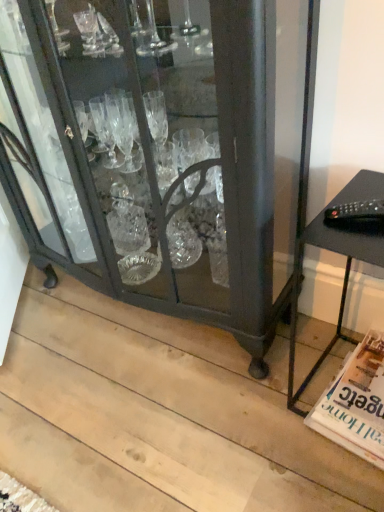
Identify the location of black matte table at right. (343, 281).

Where is `matte black cabinet at center`? matte black cabinet at center is located at coordinates (161, 152).

The width and height of the screenshot is (384, 512). What do you see at coordinates (355, 403) in the screenshot?
I see `white glossy magazine at lower right` at bounding box center [355, 403].

I want to click on black matte table at right, so click(x=343, y=281).

Which is more to the left, black matte table at right or matte black cabinet at center?

From the viewer's perspective, matte black cabinet at center appears more on the left side.

How much distance is there between black matte table at right and matte black cabinet at center?

A distance of 16.92 inches exists between black matte table at right and matte black cabinet at center.

How many degrees apart are the facing directions of black matte table at right and matte black cabinet at center?

The angular difference between black matte table at right and matte black cabinet at center is 5.83 degrees.

Does black matte table at right come in front of matte black cabinet at center?

No, it is behind matte black cabinet at center.

Is black matte table at right oriented towards white glossy magazine at lower right?

No.

In the image, is black matte table at right positioned in front of or behind white glossy magazine at lower right?

black matte table at right is positioned closer to the viewer than white glossy magazine at lower right.

Can you confirm if black matte table at right is wider than white glossy magazine at lower right?

In fact, black matte table at right might be narrower than white glossy magazine at lower right.

Who is taller, black matte table at right or white glossy magazine at lower right?

black matte table at right is taller.

Can you confirm if matte black cabinet at center is positioned to the right of black matte table at right?

In fact, matte black cabinet at center is to the left of black matte table at right.

Which of these two, matte black cabinet at center or black matte table at right, stands taller?

With more height is matte black cabinet at center.

Is matte black cabinet at center spatially inside black matte table at right, or outside of it?

matte black cabinet at center is outside black matte table at right.

Are matte black cabinet at center and black matte table at right far apart?

No, matte black cabinet at center is in close proximity to black matte table at right.

Is white glossy magazine at lower right thinner than matte black cabinet at center?

Incorrect, the width of white glossy magazine at lower right is not less than that of matte black cabinet at center.

How different are the orientations of white glossy magazine at lower right and matte black cabinet at center in degrees?

They differ by 6.92 degrees in their facing directions.

In the scene shown: Is white glossy magazine at lower right positioned with its back to matte black cabinet at center?

No, white glossy magazine at lower right's orientation is not away from matte black cabinet at center.

Which is in front, point (356, 444) or point (328, 229)?

The point (328, 229) is in front.

Who is bigger, white glossy magazine at lower right or black matte table at right?

black matte table at right is bigger.

Is white glossy magazine at lower right with black matte table at right?

They are not placed beside each other.

Relative to black matte table at right, is white glossy magazine at lower right in front or behind?

Visually, white glossy magazine at lower right is located behind black matte table at right.

Between matte black cabinet at center and white glossy magazine at lower right, which one has less height?

Standing shorter between the two is white glossy magazine at lower right.

How much distance is there between matte black cabinet at center and white glossy magazine at lower right?

matte black cabinet at center and white glossy magazine at lower right are 26.58 inches apart.

Which of these two, matte black cabinet at center or white glossy magazine at lower right, is smaller?

Smaller between the two is white glossy magazine at lower right.

Locate an element on the screen. The width and height of the screenshot is (384, 512). furniture on the left of black matte table at right is located at coordinates (161, 152).

This screenshot has width=384, height=512. Identify the location of magazine located underneath the black matte table at right (from a real-world perspective). (355, 403).

From the image, which object appears to be nearer to white glossy magazine at lower right, black matte table at right or matte black cabinet at center?

Based on the image, black matte table at right appears to be nearer to white glossy magazine at lower right.

Estimate the real-world distances between objects in this image. Which object is further from black matte table at right, matte black cabinet at center or white glossy magazine at lower right?

matte black cabinet at center lies further to black matte table at right than the other object.

Which object lies further to the anchor point white glossy magazine at lower right, matte black cabinet at center or black matte table at right?

Based on the image, matte black cabinet at center appears to be further to white glossy magazine at lower right.

Looking at the image, which one is located closer to matte black cabinet at center, black matte table at right or white glossy magazine at lower right?

The object closer to matte black cabinet at center is black matte table at right.

Estimate the real-world distances between objects in this image. Which object is closer to matte black cabinet at center, white glossy magazine at lower right or black matte table at right?

Answer: The object closer to matte black cabinet at center is black matte table at right.

Which object lies further to the anchor point black matte table at right, white glossy magazine at lower right or matte black cabinet at center?

Among the two, matte black cabinet at center is located further to black matte table at right.

Locate an element on the screen. The width and height of the screenshot is (384, 512). table between matte black cabinet at center and white glossy magazine at lower right is located at coordinates (343, 281).